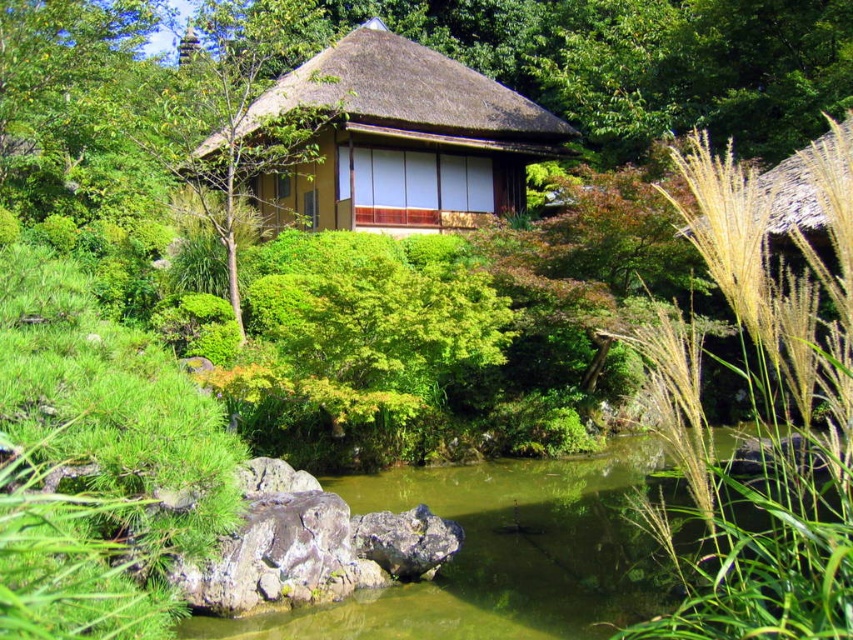
Is the position of golden grass at right less distant than that of matte brown thatched hut at center?

Yes, golden grass at right is in front of matte brown thatched hut at center.

Find the location of `golden grass at right`. golden grass at right is located at coordinates (761, 412).